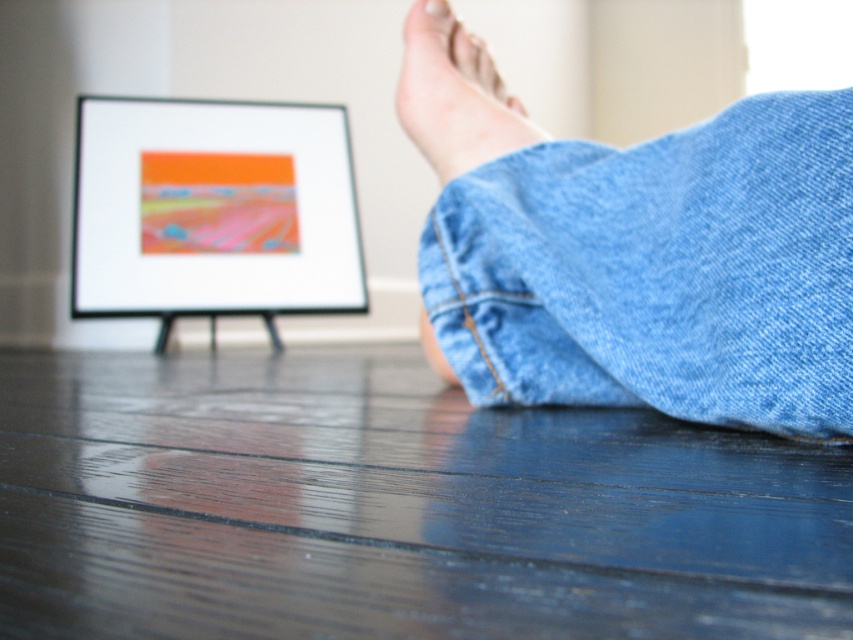
Question: Which point is farther from the camera taking this photo?

Choices:
 (A) (418, 74)
 (B) (271, 252)
 (C) (740, 416)

Answer: (B)

Question: Based on their relative distances, which object is farther from the smooth skin foot at center?

Choices:
 (A) denim at lower right
 (B) matte black picture frame at upper center

Answer: (B)

Question: Can you confirm if denim at lower right is bigger than smooth skin foot at center?

Choices:
 (A) no
 (B) yes

Answer: (B)

Question: Which point is closer to the camera taking this photo?

Choices:
 (A) (212, 122)
 (B) (679, 236)

Answer: (B)

Question: Can you confirm if matte black picture frame at upper center is wider than smooth skin foot at center?

Choices:
 (A) yes
 (B) no

Answer: (A)

Question: Observing the image, what is the correct spatial positioning of denim at lower right in reference to matte black picture frame at upper center?

Choices:
 (A) above
 (B) below

Answer: (B)